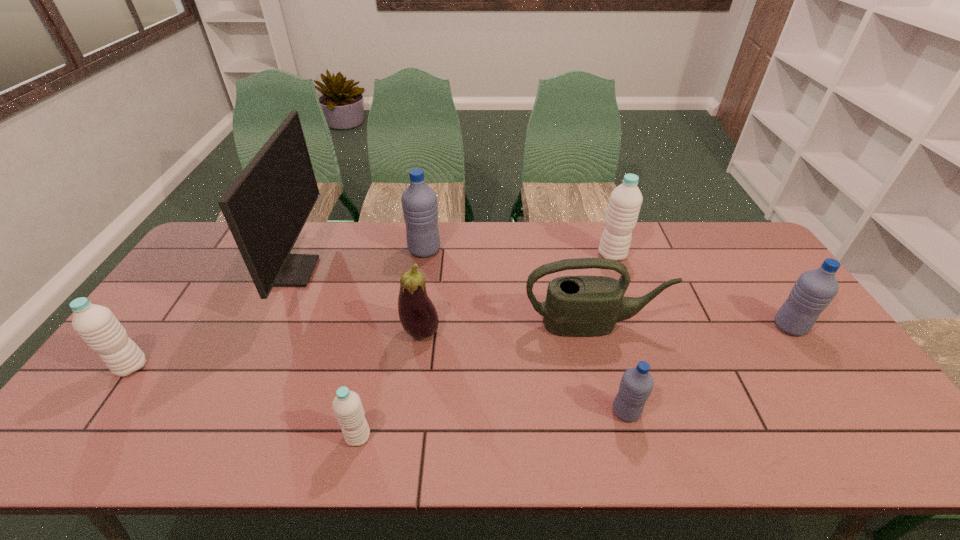
Find the location of `object that is the second nearest to the fourth farthest water bottle`. object that is the second nearest to the fourth farthest water bottle is located at coordinates (347, 406).

Identify which object is the fourth nearest to the second blue water bottle from left to right. Please provide its 2D coordinates. Your answer should be formatted as a tuple, i.e. [(x, y)], where the tuple contains the x and y coordinates of a point satisfying the conditions above.

[(625, 201)]

Find the location of a particular element. water bottle that stands as the fifth closest to the second object from left to right is located at coordinates (625, 201).

Locate an element on the screen. the fourth closest water bottle to the biggest blue water bottle is located at coordinates (96, 325).

Locate which blue water bottle ranks in proximity to the eggplant. Please provide its 2D coordinates. Your answer should be formatted as a tuple, i.e. [(x, y)], where the tuple contains the x and y coordinates of a point satisfying the conditions above.

[(419, 202)]

In order to click on blue water bottle that is the third closest one to the watering can in this screenshot , I will do `click(419, 202)`.

Locate which white water bottle is the third closest to the biggest blue water bottle. Please provide its 2D coordinates. Your answer should be formatted as a tuple, i.e. [(x, y)], where the tuple contains the x and y coordinates of a point satisfying the conditions above.

[(96, 325)]

Select which white water bottle is the third closest to the green watering can. Please provide its 2D coordinates. Your answer should be formatted as a tuple, i.e. [(x, y)], where the tuple contains the x and y coordinates of a point satisfying the conditions above.

[(96, 325)]

I want to click on free space that satisfies the following two spatial constraints: 1. on the front-facing side of the eggplant; 2. on the left side of the computer monitor, so click(x=265, y=332).

You are a GUI agent. You are given a task and a screenshot of the screen. Output one action in this format:
    pyautogui.click(x=<x>, y=<y>)
    Task: Click on the free location that satisfies the following two spatial constraints: 1. on the back side of the third farthest water bottle; 2. on the front-facing side of the computer monitor
    
    Given the screenshot: What is the action you would take?
    pyautogui.click(x=752, y=272)